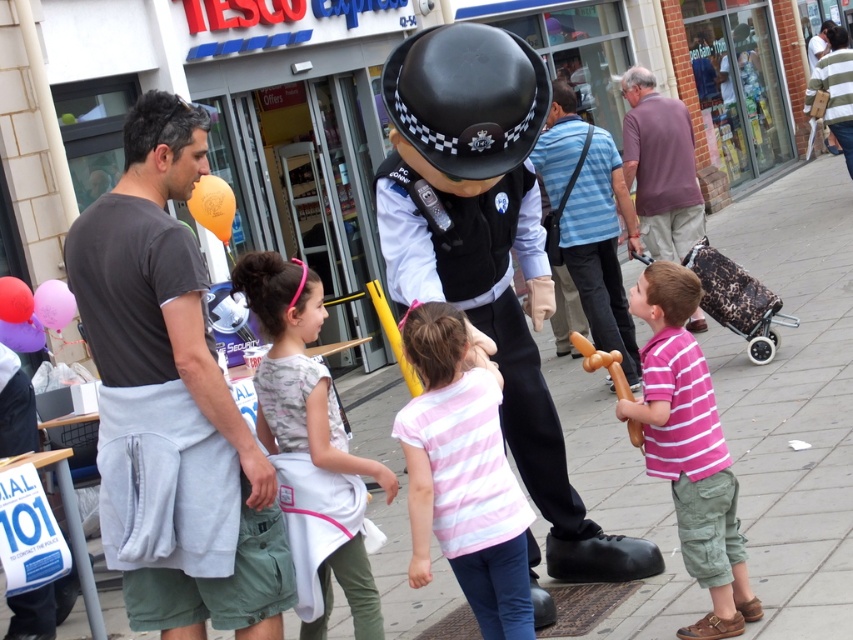
Can you confirm if pink fabric dress at center is positioned below purple cotton shirt at right?

Yes, pink fabric dress at center is below purple cotton shirt at right.

This screenshot has height=640, width=853. Identify the location of pink fabric dress at center. (297, 369).

Locate an element on the screen. The height and width of the screenshot is (640, 853). pink fabric dress at center is located at coordinates (297, 369).

Is shiny black helmet at center thinner than pink fabric dress at center?

No.

Who is more forward, (399, 257) or (289, 353)?

Point (289, 353) is more forward.

At what (x,y) coordinates should I click in order to perform the action: click on shiny black helmet at center. Please return your answer as a coordinate pair (x, y). This screenshot has height=640, width=853. Looking at the image, I should click on (486, 250).

Which is more to the right, pink striped shirt at lower right or purple cotton shirt at right?

purple cotton shirt at right

Does pink striped shirt at lower right have a smaller size compared to purple cotton shirt at right?

Yes.

Measure the distance between point (683,545) and camera.

Point (683,545) is 4.02 meters from camera.

Identify the location of pink striped shirt at lower right. (689, 449).